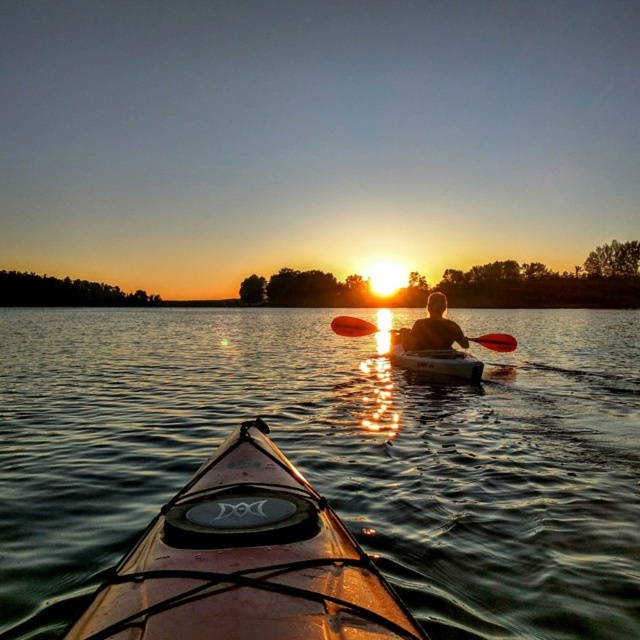
You are a photographer trying to capture the reflection of the white plastic canoe at center in the translucent water at center. Based on their positions, do you think the reflection will be visible to the right or left of the canoe?

The translucent water at center is positioned on the right side of white plastic canoe at center, so the reflection of the white plastic canoe at center will be visible to the right of the canoe.

You are planning to cross the lake in a boat that requires at least 30 feet of clearance between any obstacles. Based on the scene, can you safely navigate between the translucent water at center and the brown matte canoe at center?

The distance between the translucent water at center and the brown matte canoe at center is 27.35 feet, which is less than the required 30 feet of clearance. Therefore, navigating between them would not be safe due to insufficient space.

You are a photographer trying to capture the reflection of the sunset on the water. You notice the translucent water at center and the matte orange paddle at center. Which object should you focus on to ensure the reflection is visible?

You should focus on the translucent water at center because it is in front of the matte orange paddle at center, allowing the reflection to be clearly seen through the water.